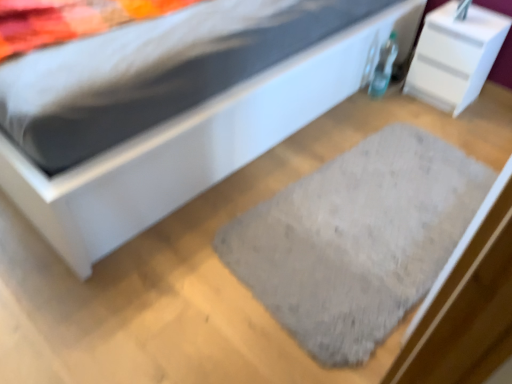
Question: Is gray fuzzy rug at center taller than white matte bed at center?

Choices:
 (A) yes
 (B) no

Answer: (B)

Question: Is gray fuzzy rug at center located outside white matte bed at center?

Choices:
 (A) yes
 (B) no

Answer: (B)

Question: Can you confirm if gray fuzzy rug at center is positioned to the right of white matte bed at center?

Choices:
 (A) yes
 (B) no

Answer: (A)

Question: Is gray fuzzy rug at center positioned behind white matte bed at center?

Choices:
 (A) no
 (B) yes

Answer: (B)

Question: From a real-world perspective, is gray fuzzy rug at center physically below white matte bed at center?

Choices:
 (A) yes
 (B) no

Answer: (B)

Question: Considering the relative sizes of gray fuzzy rug at center and white matte bed at center in the image provided, is gray fuzzy rug at center shorter than white matte bed at center?

Choices:
 (A) yes
 (B) no

Answer: (A)

Question: Can you confirm if white glossy nightstand at upper right is thinner than gray fuzzy rug at center?

Choices:
 (A) yes
 (B) no

Answer: (A)

Question: Considering the relative positions of white glossy nightstand at upper right and gray fuzzy rug at center in the image provided, is white glossy nightstand at upper right to the right of gray fuzzy rug at center from the viewer's perspective?

Choices:
 (A) yes
 (B) no

Answer: (A)

Question: Is white glossy nightstand at upper right outside gray fuzzy rug at center?

Choices:
 (A) no
 (B) yes

Answer: (B)

Question: Is white glossy nightstand at upper right directly adjacent to gray fuzzy rug at center?

Choices:
 (A) yes
 (B) no

Answer: (B)

Question: Is white glossy nightstand at upper right taller than gray fuzzy rug at center?

Choices:
 (A) no
 (B) yes

Answer: (B)

Question: Could you tell me if white glossy nightstand at upper right is facing gray fuzzy rug at center?

Choices:
 (A) yes
 (B) no

Answer: (A)

Question: Is white glossy nightstand at upper right with white matte bed at center?

Choices:
 (A) yes
 (B) no

Answer: (B)